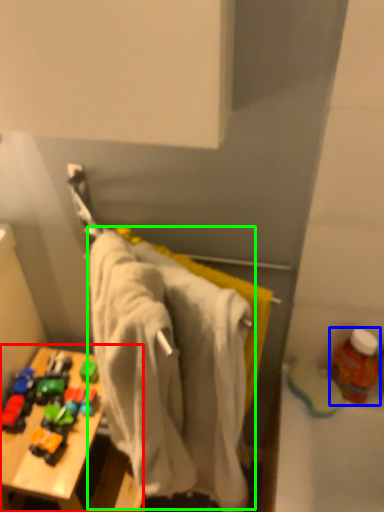
Question: Based on their relative distances, which object is nearer to table (highlighted by a red box)? Choose from bottle (highlighted by a blue box) and bath towel (highlighted by a green box).

Choices:
 (A) bottle
 (B) bath towel

Answer: (B)